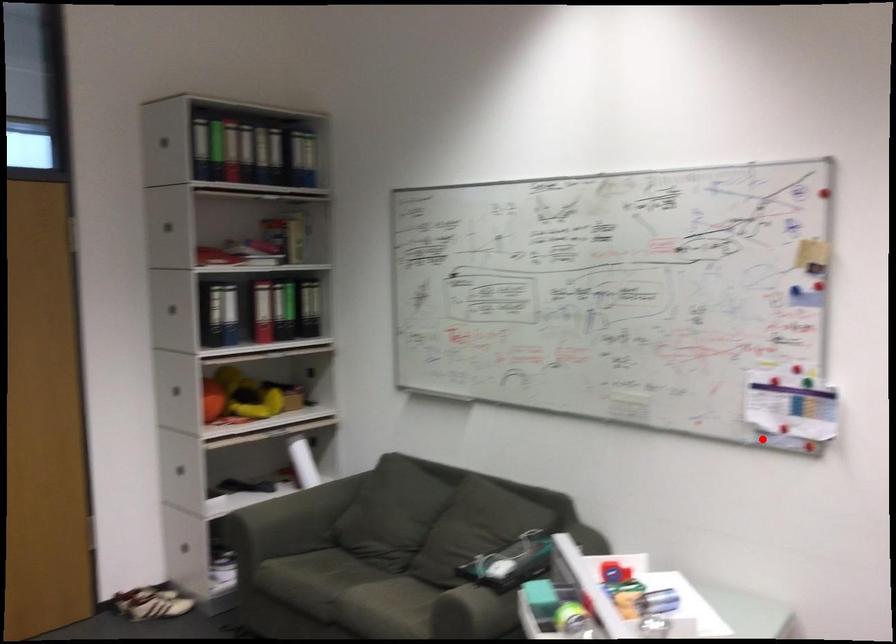
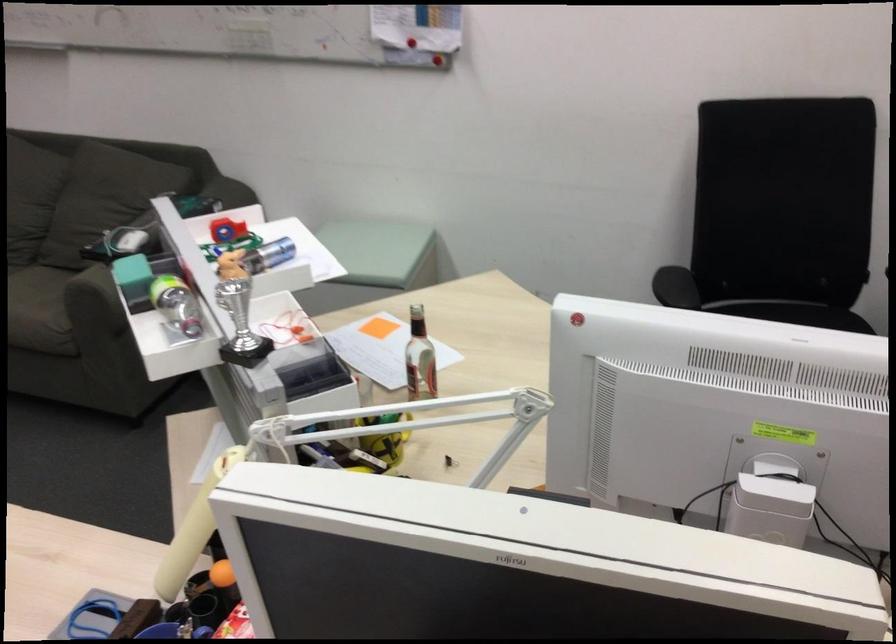
Where in the second image is the point corresponding to the highlighted location from the first image?

(409, 59)